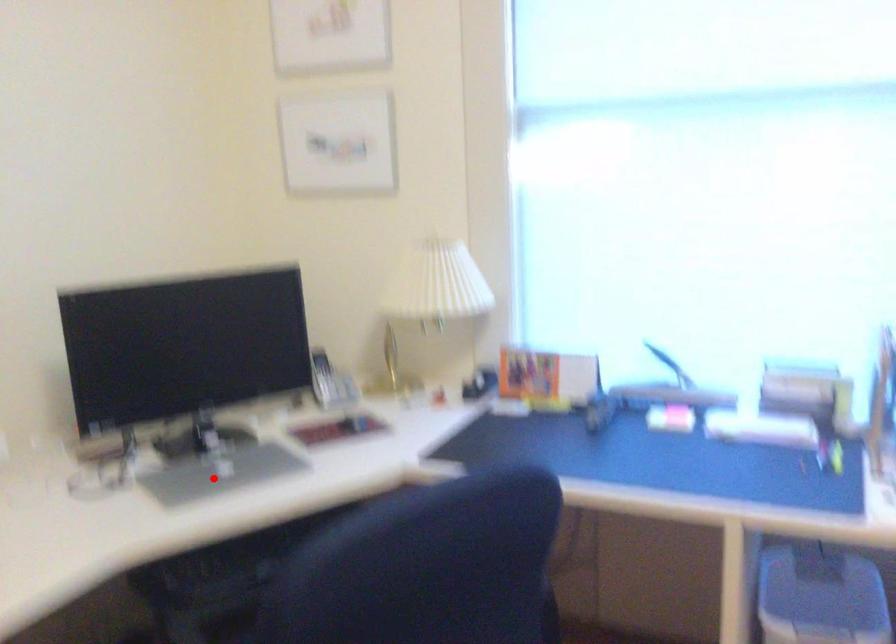
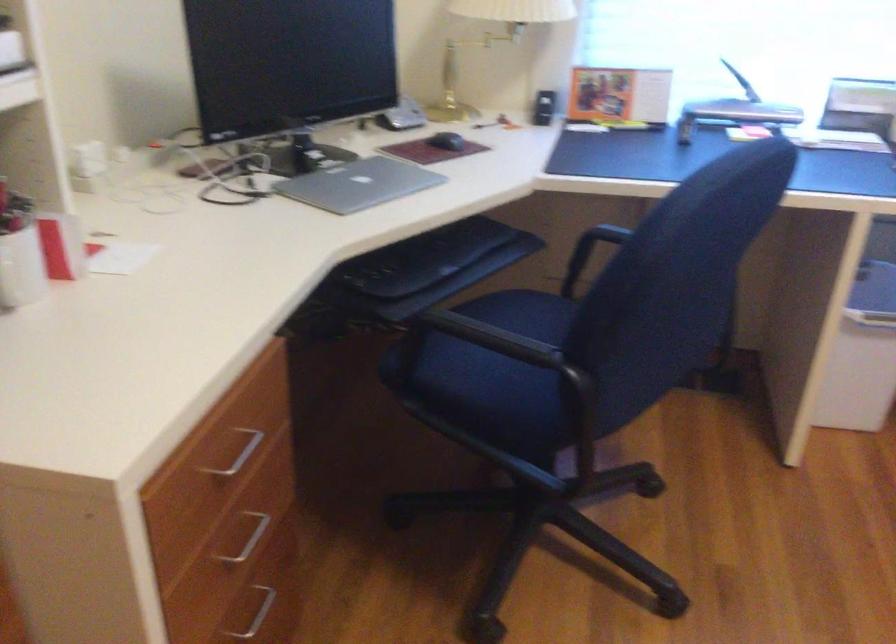
In the second image, find the point that corresponds to the highlighted location in the first image.

(358, 184)